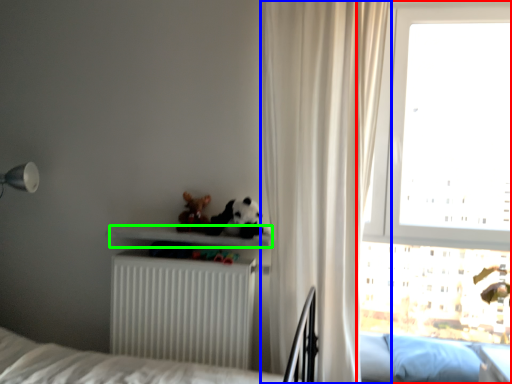
Question: Considering the real-world distances, which object is farthest from window (highlighted by a red box)? curtain (highlighted by a blue box) or shelf (highlighted by a green box)?

Choices:
 (A) curtain
 (B) shelf

Answer: (B)